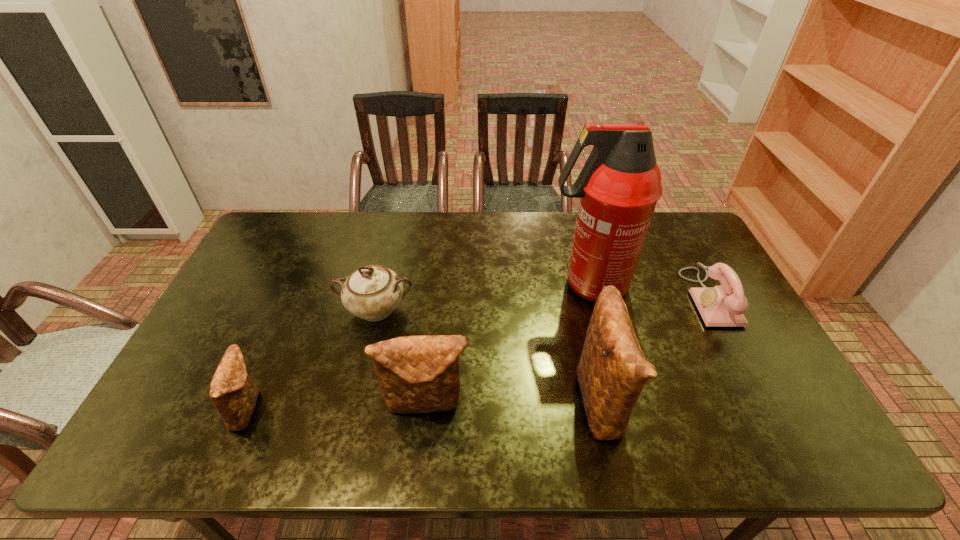
In the image, there is a desktop. Where is `vacant space at the left edge`? This screenshot has width=960, height=540. vacant space at the left edge is located at coordinates [x=253, y=255].

Find the location of a particular element. This screenshot has height=540, width=960. vacant space at the right edge of the desktop is located at coordinates (720, 360).

Where is `free space at the far left corner`? The height and width of the screenshot is (540, 960). free space at the far left corner is located at coordinates (304, 235).

Where is `vacant region at the far right corner of the desktop`? vacant region at the far right corner of the desktop is located at coordinates (672, 241).

Find the location of a particular element. The height and width of the screenshot is (540, 960). vacant space that is in between the rightmost object and the chinaware is located at coordinates (x=542, y=303).

Locate an element on the screen. This screenshot has width=960, height=540. vacant space in between the telephone and the second clutch bag from left to right is located at coordinates (567, 350).

Find the location of a particular element. The width and height of the screenshot is (960, 540). free spot between the chinaware and the rightmost clutch bag is located at coordinates (489, 354).

This screenshot has width=960, height=540. I want to click on unoccupied position between the chinaware and the fire extinguisher, so click(x=482, y=298).

The height and width of the screenshot is (540, 960). What are the coordinates of `vacant space that's between the tallest object and the chinaware` in the screenshot? It's located at (482, 298).

Where is `vacant space that's between the rightmost clutch bag and the second tallest clutch bag`? This screenshot has width=960, height=540. vacant space that's between the rightmost clutch bag and the second tallest clutch bag is located at coordinates (x=514, y=401).